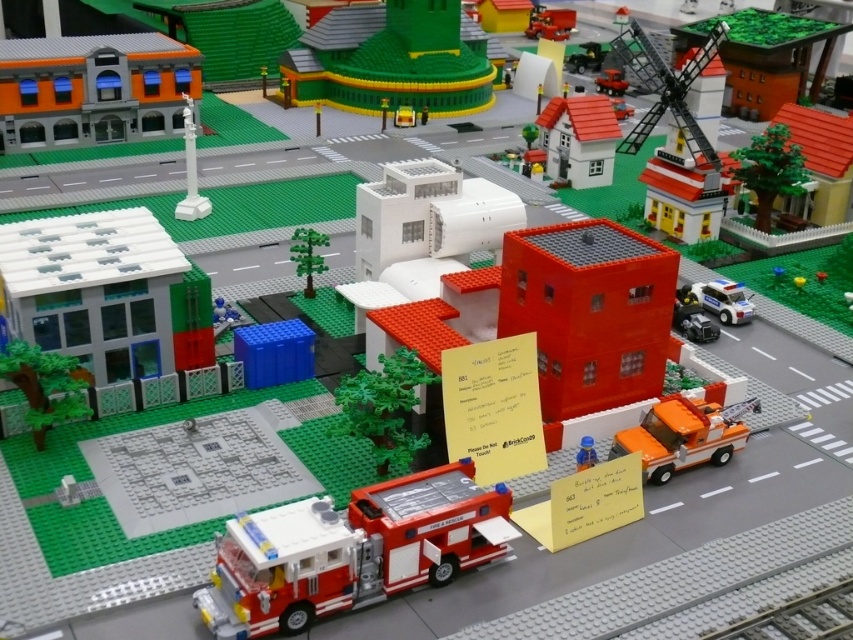
Is translucent blue plastic bottle at center to the left of brick-like yellow brick at center from the viewer's perspective?

No, translucent blue plastic bottle at center is not to the left of brick-like yellow brick at center.

Can you confirm if translucent blue plastic bottle at center is bigger than brick-like yellow brick at center?

No, translucent blue plastic bottle at center is not bigger than brick-like yellow brick at center.

Consider the image. Measure the distance between translucent blue plastic bottle at center and camera.

translucent blue plastic bottle at center and camera are 8.98 feet apart.

The width and height of the screenshot is (853, 640). What are the coordinates of `translucent blue plastic bottle at center` in the screenshot? It's located at (585, 452).

Between point (476, 108) and point (300, 244), which one is positioned in front?

Point (300, 244)

Which is above, green matte tower at upper center or green matte tree at center?

green matte tower at upper center is above.

Between point (425, 74) and point (299, 252), which one is positioned behind?

The point (425, 74) is behind.

This screenshot has height=640, width=853. Find the location of `green matte tower at upper center`. green matte tower at upper center is located at coordinates (392, 60).

This screenshot has width=853, height=640. In order to click on smooth plastic toy car at upper center in this screenshot , I will do `click(550, 22)`.

Between smooth plastic toy car at upper center and translucent blue plastic bottle at center, which one appears on the left side from the viewer's perspective?

Positioned to the left is translucent blue plastic bottle at center.

Identify the location of smooth plastic toy car at upper center. The image size is (853, 640). (550, 22).